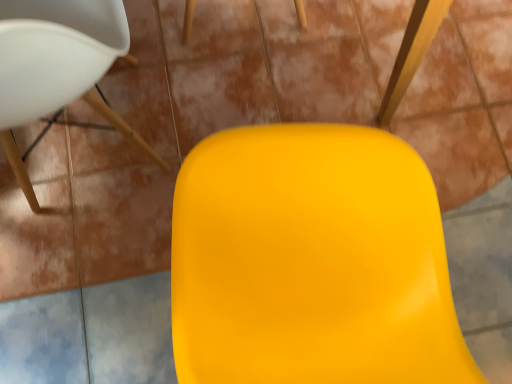
Question: Is matte white chair at upper left situated inside glossy plastic swivel chair at center or outside?

Choices:
 (A) outside
 (B) inside

Answer: (A)

Question: Relative to glossy plastic swivel chair at center, is matte white chair at upper left in front or behind?

Choices:
 (A) front
 (B) behind

Answer: (B)

Question: Is matte white chair at upper left wider or thinner than glossy plastic swivel chair at center?

Choices:
 (A) thin
 (B) wide

Answer: (B)

Question: Is glossy plastic swivel chair at center bigger or smaller than matte white chair at upper left?

Choices:
 (A) small
 (B) big

Answer: (A)

Question: Do you think glossy plastic swivel chair at center is within matte white chair at upper left, or outside of it?

Choices:
 (A) inside
 (B) outside

Answer: (B)

Question: Is glossy plastic swivel chair at center to the left or to the right of matte white chair at upper left in the image?

Choices:
 (A) right
 (B) left

Answer: (A)

Question: From the image's perspective, is glossy plastic swivel chair at center above or below matte white chair at upper left?

Choices:
 (A) above
 (B) below

Answer: (B)